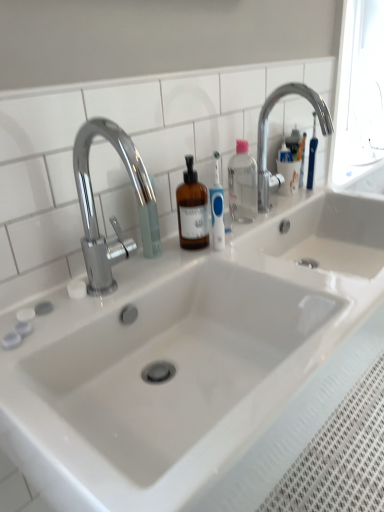
This screenshot has height=512, width=384. Describe the element at coordinates (112, 216) in the screenshot. I see `chrome metallic faucet at left, which is counted as the second tap, starting from the right` at that location.

I want to click on chrome metallic faucet at left, acting as the 2th tap starting from the back, so click(x=112, y=216).

This screenshot has width=384, height=512. I want to click on clear plastic bottle at center, so click(242, 184).

Identify the location of chrome metallic faucet at left, which is counted as the second tap, starting from the right. The width and height of the screenshot is (384, 512). (112, 216).

Can you confirm if chrome metallic faucet at upper right, the 2th tap in the left-to-right sequence, is wider than chrome metallic faucet at left, the 1th tap from the front?

Correct, the width of chrome metallic faucet at upper right, the 2th tap in the left-to-right sequence, exceeds that of chrome metallic faucet at left, the 1th tap from the front.

The height and width of the screenshot is (512, 384). Find the location of `tap on the left of the chrome metallic faucet at upper right, the 2th tap in the left-to-right sequence`. tap on the left of the chrome metallic faucet at upper right, the 2th tap in the left-to-right sequence is located at coordinates [112, 216].

From the picture: Is chrome metallic faucet at upper right, which appears as the 2th tap when viewed from the front, situated inside chrome metallic faucet at left, arranged as the 1th tap when viewed from the left, or outside?

The correct answer is: outside.

Considering the positions of points (295, 93) and (97, 270), is point (295, 93) closer to camera compared to point (97, 270)?

No, (295, 93) is further to viewer.

Does chrome metallic faucet at left, acting as the 2th tap starting from the back, have a greater width compared to clear plastic bottle at center?

Yes, chrome metallic faucet at left, acting as the 2th tap starting from the back, is wider than clear plastic bottle at center.

Which is more to the left, chrome metallic faucet at left, arranged as the 1th tap when viewed from the left, or clear plastic bottle at center?

chrome metallic faucet at left, arranged as the 1th tap when viewed from the left, is more to the left.

In the scene shown: Would you say chrome metallic faucet at left, which is counted as the second tap, starting from the right, contains clear plastic bottle at center?

No, clear plastic bottle at center is located outside of chrome metallic faucet at left, which is counted as the second tap, starting from the right.

From their relative heights in the image, would you say chrome metallic faucet at left, acting as the 2th tap starting from the back, is taller or shorter than clear plastic bottle at center?

Considering their sizes, chrome metallic faucet at left, acting as the 2th tap starting from the back, has more height than clear plastic bottle at center.

Is chrome metallic faucet at left, which is counted as the second tap, starting from the right, wider or thinner than chrome metallic faucet at upper right, which appears as the 2th tap when viewed from the front?

chrome metallic faucet at left, which is counted as the second tap, starting from the right, is thinner than chrome metallic faucet at upper right, which appears as the 2th tap when viewed from the front.

In terms of height, does chrome metallic faucet at left, which is counted as the second tap, starting from the right, look taller or shorter compared to chrome metallic faucet at upper right, which is counted as the first tap, starting from the right?

chrome metallic faucet at left, which is counted as the second tap, starting from the right, is taller than chrome metallic faucet at upper right, which is counted as the first tap, starting from the right.

From the image's perspective, is chrome metallic faucet at left, which is counted as the second tap, starting from the right, positioned above or below chrome metallic faucet at upper right, which appears as the 2th tap when viewed from the front?

chrome metallic faucet at left, which is counted as the second tap, starting from the right, is below chrome metallic faucet at upper right, which appears as the 2th tap when viewed from the front.

Is point (114, 218) positioned before point (258, 124)?

That is True.

Would you consider clear plastic bottle at center to be distant from chrome metallic faucet at upper right, which appears as the 2th tap when viewed from the front?

clear plastic bottle at center is actually quite close to chrome metallic faucet at upper right, which appears as the 2th tap when viewed from the front.

Which object is further away from the camera taking this photo, clear plastic bottle at center or chrome metallic faucet at upper right, which is counted as the first tap, starting from the right?

clear plastic bottle at center is more distant.

Who is shorter, clear plastic bottle at center or chrome metallic faucet at upper right, which is counted as the first tap, starting from the right?

Standing shorter between the two is clear plastic bottle at center.

Who is shorter, clear plastic bottle at center or chrome metallic faucet at left, the 1th tap from the front?

Standing shorter between the two is clear plastic bottle at center.

Is point (232, 182) more distant than point (130, 166)?

That is True.

Could you tell me if clear plastic bottle at center is turned towards chrome metallic faucet at left, acting as the 2th tap starting from the back?

No, clear plastic bottle at center does not turn towards chrome metallic faucet at left, acting as the 2th tap starting from the back.

Is clear plastic bottle at center with chrome metallic faucet at left, arranged as the 1th tap when viewed from the left?

clear plastic bottle at center and chrome metallic faucet at left, arranged as the 1th tap when viewed from the left, are clearly separated.

Are chrome metallic faucet at upper right, the 2th tap in the left-to-right sequence, and clear plastic bottle at center far apart?

That's not correct — chrome metallic faucet at upper right, the 2th tap in the left-to-right sequence, is a little close to clear plastic bottle at center.

In the scene shown: Would you say clear plastic bottle at center is part of chrome metallic faucet at upper right, which is counted as the first tap, starting from the right,'s contents?

No.

From a real-world perspective, is chrome metallic faucet at upper right, which appears as the 2th tap when viewed from the front, physically above clear plastic bottle at center?

Indeed, from a real-world perspective, chrome metallic faucet at upper right, which appears as the 2th tap when viewed from the front, stands above clear plastic bottle at center.

Which is more to the right, chrome metallic faucet at upper right, which is counted as the 1th tap, starting from the back, or clear plastic bottle at center?

chrome metallic faucet at upper right, which is counted as the 1th tap, starting from the back, is more to the right.

This screenshot has height=512, width=384. In order to click on tap that appears below the chrome metallic faucet at upper right, which is counted as the first tap, starting from the right (from the image's perspective) in this screenshot , I will do `click(112, 216)`.

At what (x,y) coordinates should I click in order to perform the action: click on bottle below the chrome metallic faucet at left, arranged as the 1th tap when viewed from the left (from a real-world perspective). Please return your answer as a coordinate pair (x, y). The width and height of the screenshot is (384, 512). Looking at the image, I should click on (242, 184).

Considering their positions, is chrome metallic faucet at upper right, which is counted as the first tap, starting from the right, positioned further to clear plastic bottle at center than chrome metallic faucet at left, the 1th tap from the front?

The object further to clear plastic bottle at center is chrome metallic faucet at left, the 1th tap from the front.

Estimate the real-world distances between objects in this image. Which object is further from chrome metallic faucet at left, the 1th tap from the front, chrome metallic faucet at upper right, which is counted as the 1th tap, starting from the back, or clear plastic bottle at center?

The object further to chrome metallic faucet at left, the 1th tap from the front, is chrome metallic faucet at upper right, which is counted as the 1th tap, starting from the back.

Based on their spatial positions, is chrome metallic faucet at left, arranged as the 1th tap when viewed from the left, or clear plastic bottle at center further from chrome metallic faucet at upper right, which is counted as the 1th tap, starting from the back?

The object further to chrome metallic faucet at upper right, which is counted as the 1th tap, starting from the back, is chrome metallic faucet at left, arranged as the 1th tap when viewed from the left.

Considering their positions, is clear plastic bottle at center positioned closer to chrome metallic faucet at left, which is counted as the second tap, starting from the right, than chrome metallic faucet at upper right, which is counted as the 1th tap, starting from the back?

Among the two, clear plastic bottle at center is located nearer to chrome metallic faucet at left, which is counted as the second tap, starting from the right.

Looking at the image, which one is located closer to clear plastic bottle at center, chrome metallic faucet at left, acting as the 2th tap starting from the back, or chrome metallic faucet at upper right, which is counted as the 1th tap, starting from the back?

chrome metallic faucet at upper right, which is counted as the 1th tap, starting from the back, is closer to clear plastic bottle at center.

From the image, which object appears to be nearer to chrome metallic faucet at upper right, the 2th tap in the left-to-right sequence, clear plastic bottle at center or chrome metallic faucet at left, arranged as the 1th tap when viewed from the left?

clear plastic bottle at center.

This screenshot has height=512, width=384. What are the coordinates of `bottle located between chrome metallic faucet at left, acting as the 2th tap starting from the back, and chrome metallic faucet at upper right, which is counted as the first tap, starting from the right, in the left-right direction` in the screenshot? It's located at (242, 184).